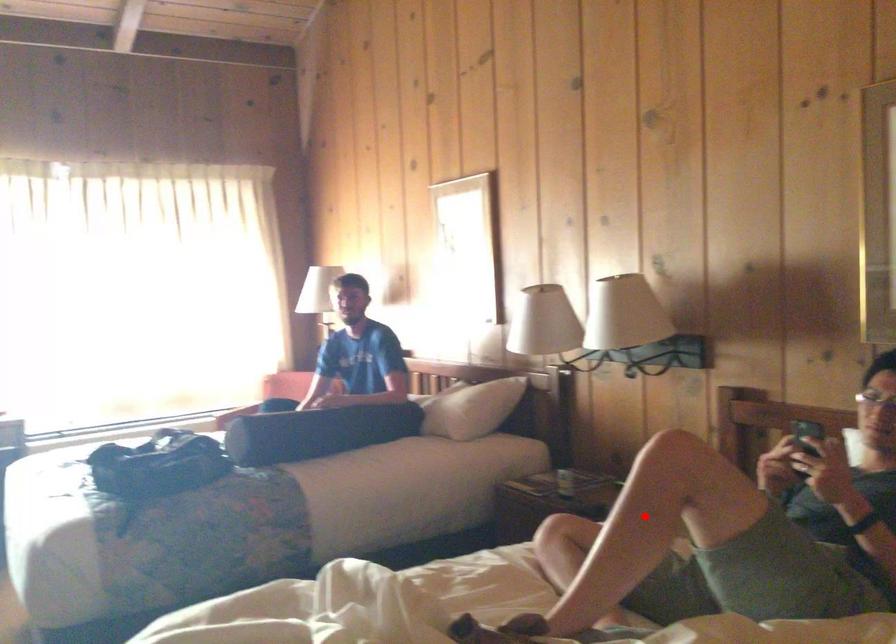
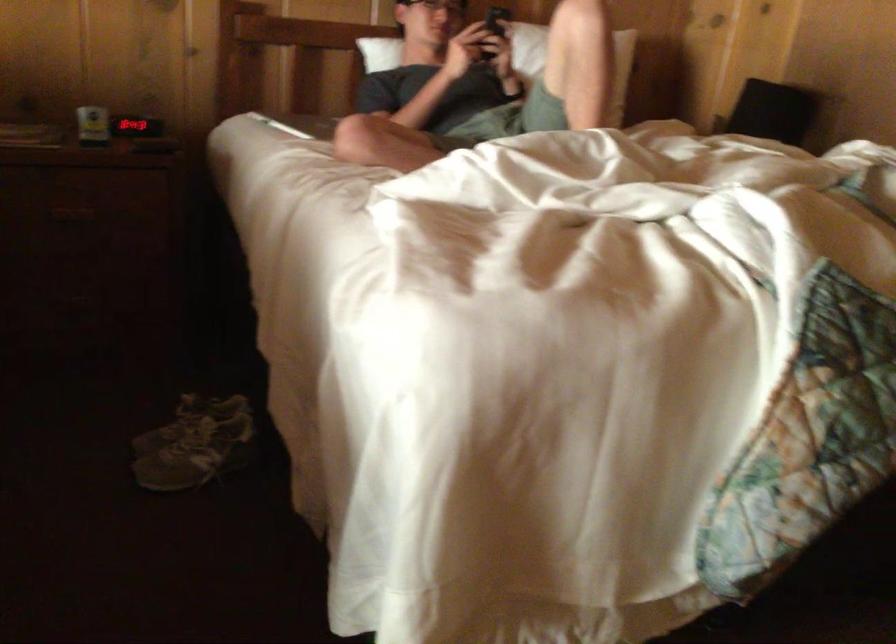
The point at the highlighted location is marked in the first image. Where is the corresponding point in the second image?

(573, 61)